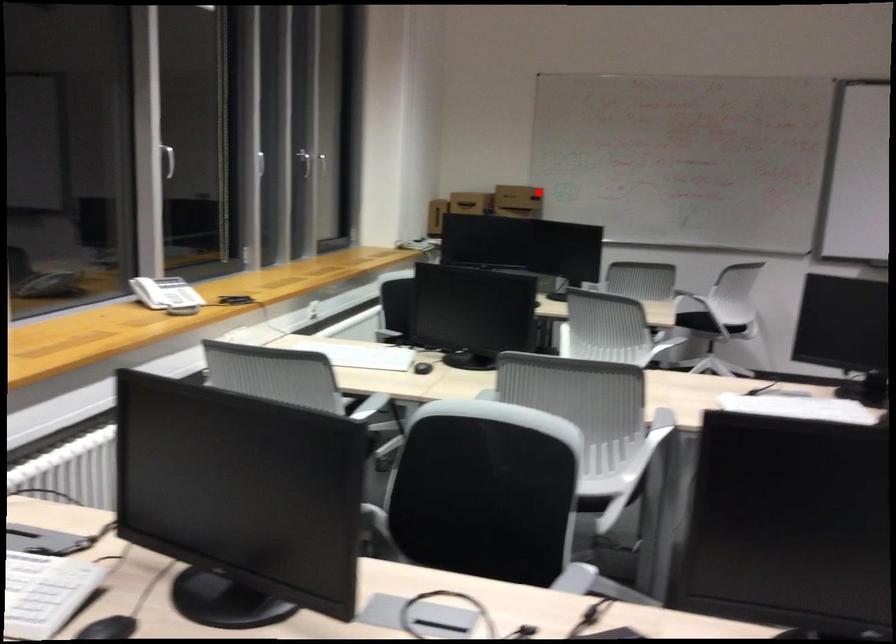
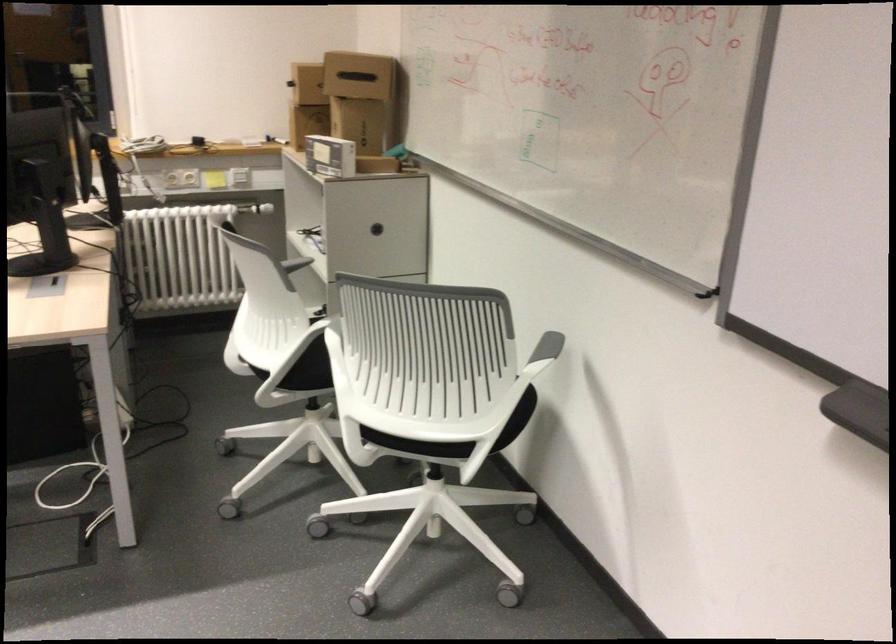
Locate, in the second image, the point that corresponds to the highlighted location in the first image.

(358, 75)